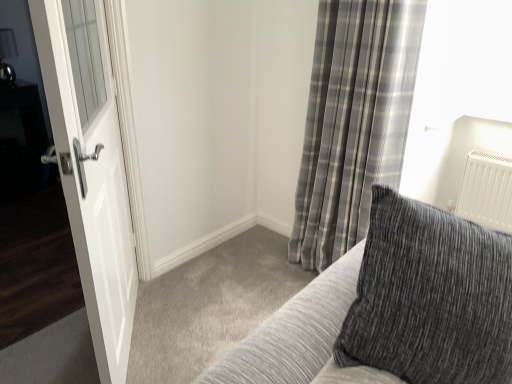
Question: Is there a large distance between gray plaid curtain at upper right and textured gray pillow at upper right?

Choices:
 (A) no
 (B) yes

Answer: (B)

Question: Does gray plaid curtain at upper right have a lesser height compared to textured gray pillow at upper right?

Choices:
 (A) yes
 (B) no

Answer: (B)

Question: Could you tell me if gray plaid curtain at upper right is facing textured gray pillow at upper right?

Choices:
 (A) no
 (B) yes

Answer: (A)

Question: Considering the relative sizes of gray plaid curtain at upper right and textured gray pillow at upper right in the image provided, is gray plaid curtain at upper right bigger than textured gray pillow at upper right?

Choices:
 (A) yes
 (B) no

Answer: (A)

Question: Are gray plaid curtain at upper right and textured gray pillow at upper right making contact?

Choices:
 (A) no
 (B) yes

Answer: (A)

Question: Based on their positions, is gray plaid curtain at upper right located to the left or right of textured gray pillow at upper right?

Choices:
 (A) right
 (B) left

Answer: (A)

Question: Looking at their shapes, would you say gray plaid curtain at upper right is wider or thinner than textured gray pillow at upper right?

Choices:
 (A) wide
 (B) thin

Answer: (B)

Question: In terms of size, does gray plaid curtain at upper right appear bigger or smaller than textured gray pillow at upper right?

Choices:
 (A) big
 (B) small

Answer: (A)

Question: In terms of height, does gray plaid curtain at upper right look taller or shorter compared to textured gray pillow at upper right?

Choices:
 (A) short
 (B) tall

Answer: (B)

Question: Choose the correct answer: Is textured gray pillow at upper right inside white glossy door at left or outside it?

Choices:
 (A) outside
 (B) inside

Answer: (A)

Question: From a real-world perspective, is textured gray pillow at upper right above or below white glossy door at left?

Choices:
 (A) below
 (B) above

Answer: (B)

Question: Is textured gray pillow at upper right bigger or smaller than white glossy door at left?

Choices:
 (A) big
 (B) small

Answer: (A)

Question: Considering the positions of point (376, 311) and point (89, 180), is point (376, 311) closer or farther from the camera than point (89, 180)?

Choices:
 (A) closer
 (B) farther

Answer: (A)

Question: Considering the positions of gray plaid curtain at upper right and white glossy door at left in the image, is gray plaid curtain at upper right taller or shorter than white glossy door at left?

Choices:
 (A) tall
 (B) short

Answer: (A)

Question: Is gray plaid curtain at upper right to the left or to the right of white glossy door at left in the image?

Choices:
 (A) left
 (B) right

Answer: (B)